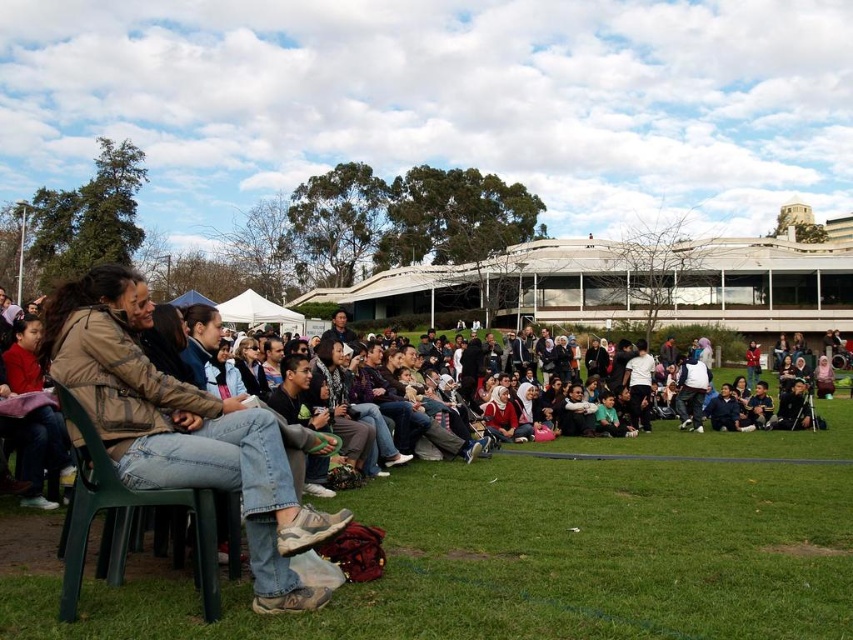
You are standing at the center of the park and looking towards the lower left. What do you see at point (554,552)?

At point (554,552), there is green grass at lower left.

You are standing in the park and see the green grass at lower left and the denim jeans at left. Which object is nearer to you?

The green grass at lower left is closer to the viewer than the denim jeans at left.